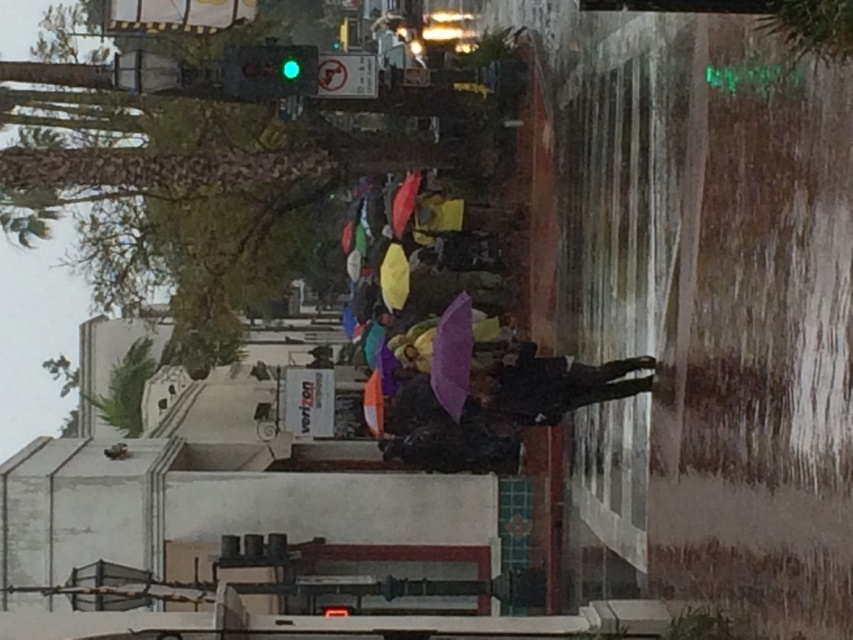
Question: Which point is farther from the camera taking this photo?

Choices:
 (A) (314, 51)
 (B) (519, 394)
 (C) (434, 396)

Answer: (A)

Question: Does green glass traffic light at upper center lie in front of purple matte umbrella at center?

Choices:
 (A) no
 (B) yes

Answer: (A)

Question: Is dark matte jacket at center positioned in front of purple matte umbrella at center?

Choices:
 (A) no
 (B) yes

Answer: (B)

Question: Which of these objects is positioned farthest from the dark matte jacket at center?

Choices:
 (A) green glass traffic light at upper center
 (B) purple matte umbrella at center

Answer: (A)

Question: Does dark matte jacket at center appear under green glass traffic light at upper center?

Choices:
 (A) yes
 (B) no

Answer: (A)

Question: Considering the real-world distances, which object is closest to the dark matte jacket at center?

Choices:
 (A) purple matte umbrella at center
 (B) green glass traffic light at upper center

Answer: (A)